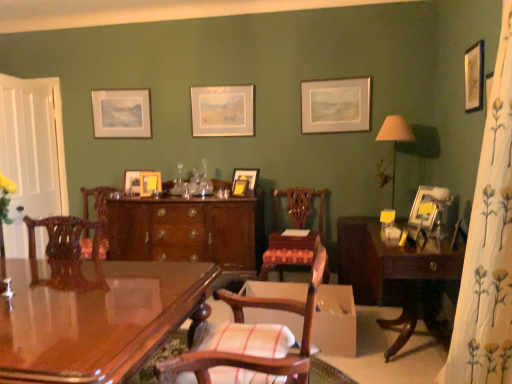
Question: Does matte wooden picture frame at upper left, which appears as the first picture frame when viewed from the left, have a smaller size compared to glossy wood desk at center?

Choices:
 (A) no
 (B) yes

Answer: (B)

Question: Is matte wooden picture frame at upper left, which appears as the first picture frame when viewed from the left, placed right next to glossy wood desk at center?

Choices:
 (A) yes
 (B) no

Answer: (B)

Question: From a real-world perspective, is matte wooden picture frame at upper left, marked as the ninth picture frame in a right-to-left arrangement, over glossy wood desk at center?

Choices:
 (A) yes
 (B) no

Answer: (A)

Question: From the image's perspective, is matte wooden picture frame at upper left, which is counted as the first picture frame, starting from the back, under glossy wood desk at center?

Choices:
 (A) no
 (B) yes

Answer: (A)

Question: Can you confirm if matte wooden picture frame at upper left, positioned as the 9th picture frame in front-to-back order, is wider than glossy wood desk at center?

Choices:
 (A) yes
 (B) no

Answer: (B)

Question: Can you confirm if matte wooden picture frame at upper left, which appears as the first picture frame when viewed from the left, is shorter than glossy wood desk at center?

Choices:
 (A) yes
 (B) no

Answer: (A)

Question: Is beige fabric lampshade at right further to camera compared to matte yellow picture frame at center, which appears as the 3th picture frame when viewed from the left?

Choices:
 (A) no
 (B) yes

Answer: (A)

Question: Is beige fabric lampshade at right closer to camera compared to matte yellow picture frame at center, which appears as the 3th picture frame when viewed from the left?

Choices:
 (A) no
 (B) yes

Answer: (B)

Question: From the image's perspective, would you say beige fabric lampshade at right is positioned over matte yellow picture frame at center, which ranks as the 7th picture frame in right-to-left order?

Choices:
 (A) no
 (B) yes

Answer: (B)

Question: Is beige fabric lampshade at right positioned with its back to matte yellow picture frame at center, which appears as the 3th picture frame when viewed from the left?

Choices:
 (A) yes
 (B) no

Answer: (B)

Question: From the image's perspective, would you say beige fabric lampshade at right is shown under matte yellow picture frame at center, which ranks as the 4th picture frame in back-to-front order?

Choices:
 (A) no
 (B) yes

Answer: (A)

Question: Is beige fabric lampshade at right positioned far away from matte yellow picture frame at center, acting as the sixth picture frame starting from the front?

Choices:
 (A) no
 (B) yes

Answer: (B)

Question: Does white wood screen door at left have a greater height compared to white floral fabric curtain at right?

Choices:
 (A) yes
 (B) no

Answer: (B)